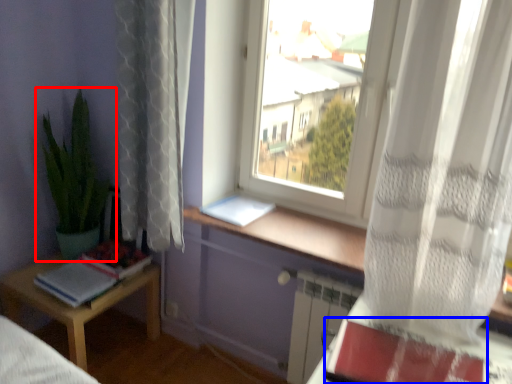
Question: Among these objects, which one is farthest to the camera, houseplant (highlighted by a red box) or paperback book (highlighted by a blue box)?

Choices:
 (A) houseplant
 (B) paperback book

Answer: (A)